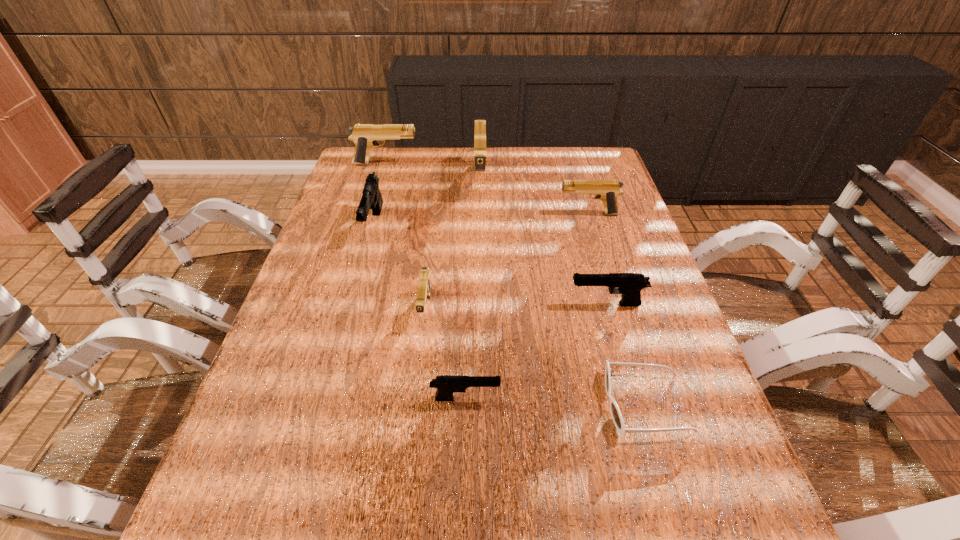
This screenshot has height=540, width=960. Find the location of `the biggest tan pistol`. the biggest tan pistol is located at coordinates (480, 125).

Identify the location of the tallest pistol. point(480,125).

In order to click on the leftmost tan pistol in this screenshot , I will do `click(364, 136)`.

Find the location of a particular element. This screenshot has height=540, width=960. the biggest black pistol is located at coordinates (371, 198).

Locate an element on the screen. the farthest black pistol is located at coordinates (371, 198).

At what (x,y) coordinates should I click in order to perform the action: click on the third biggest tan pistol. Please return your answer as a coordinate pair (x, y). The width and height of the screenshot is (960, 540). Looking at the image, I should click on (607, 191).

The width and height of the screenshot is (960, 540). I want to click on the second nearest tan pistol, so click(607, 191).

This screenshot has width=960, height=540. Identify the location of the second nearest black pistol. (630, 285).

Identify the location of the second smallest black pistol. (630, 285).

The width and height of the screenshot is (960, 540). I want to click on the smallest tan pistol, so click(424, 288).